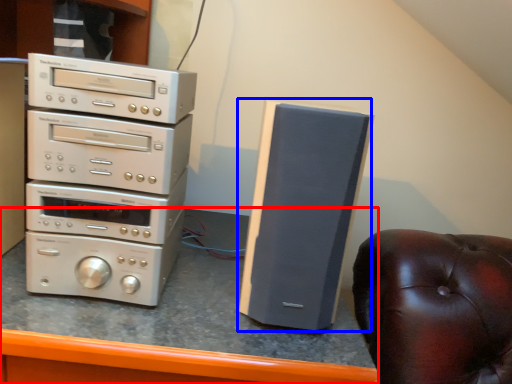
Question: Which of the following is the closest to the observer, computer desk (highlighted by a red box) or speaker (highlighted by a blue box)?

Choices:
 (A) computer desk
 (B) speaker

Answer: (A)